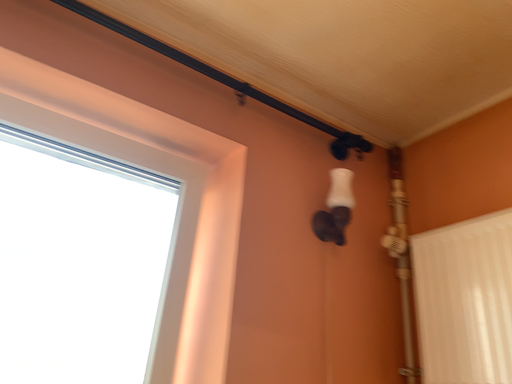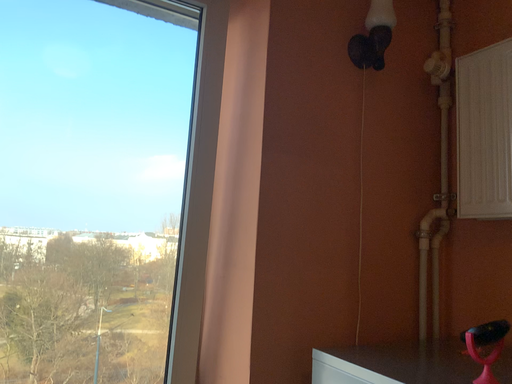
Question: How did the camera likely rotate when shooting the video?

Choices:
 (A) rotated upward
 (B) rotated downward

Answer: (B)